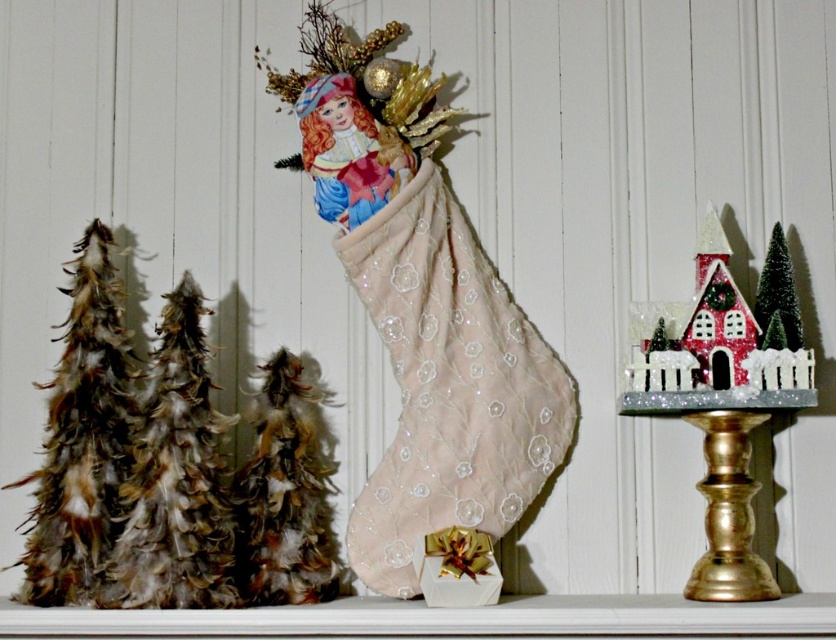
You are standing in front of the festive holiday display. You see the feathered christmas tree at left and the feathered brown christmas trees at left. Which one is positioned more to the left side?

The feathered christmas tree at left is positioned more to the left side than the feathered brown christmas trees at left.